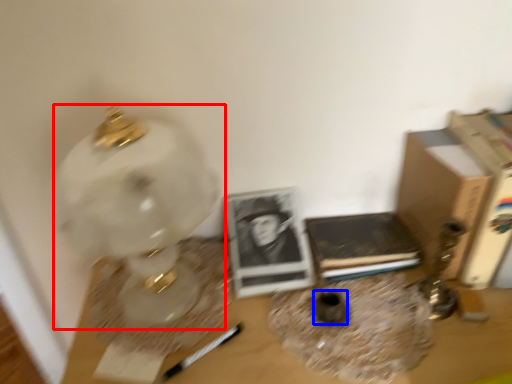
Question: Which point is closer to the camera, lamp (highlighted by a red box) or vase (highlighted by a blue box)?

Choices:
 (A) lamp
 (B) vase

Answer: (A)